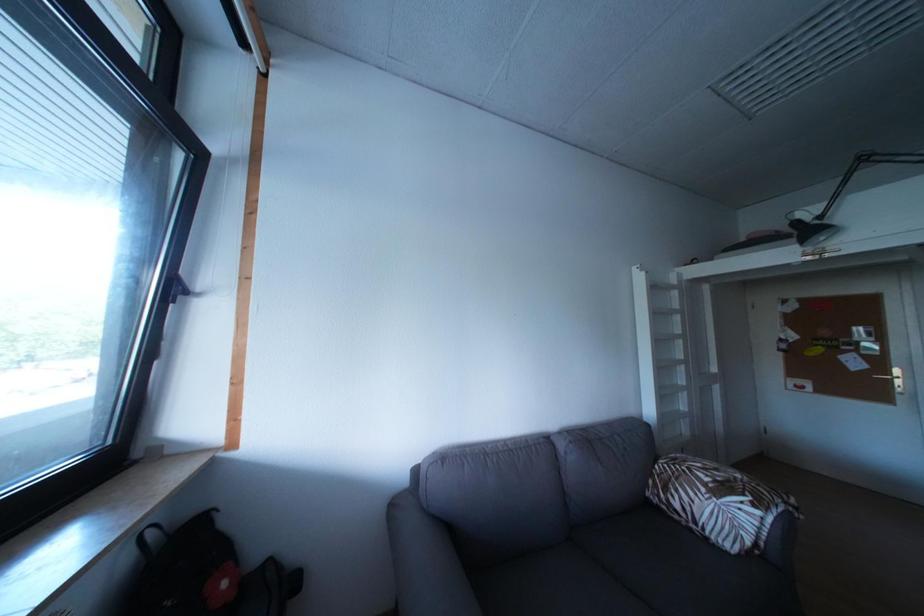
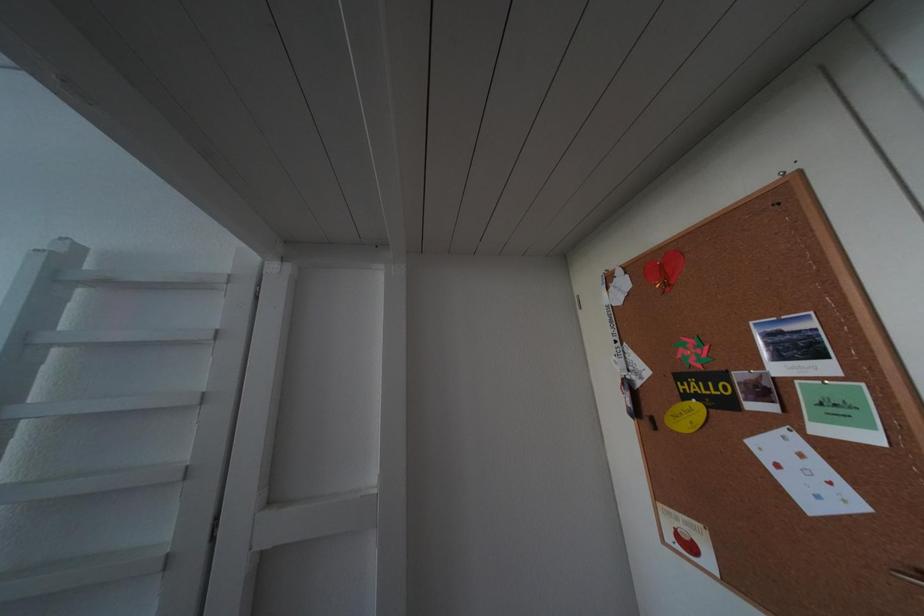
What movement of the cameraman would produce the second image?

The movement direction of the cameraman is right, forward.